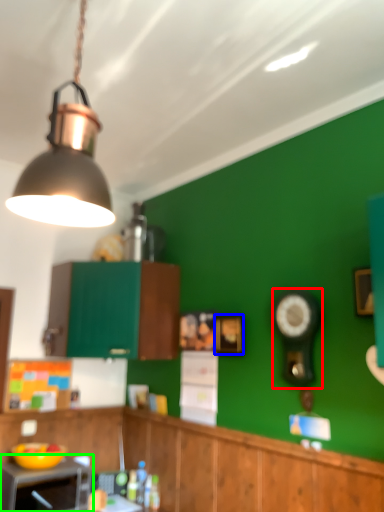
Question: Estimate the real-world distances between objects in this image. Which object is closer to clock (highlighted by a red box), picture frame (highlighted by a blue box) or appliance (highlighted by a green box)?

Choices:
 (A) picture frame
 (B) appliance

Answer: (A)